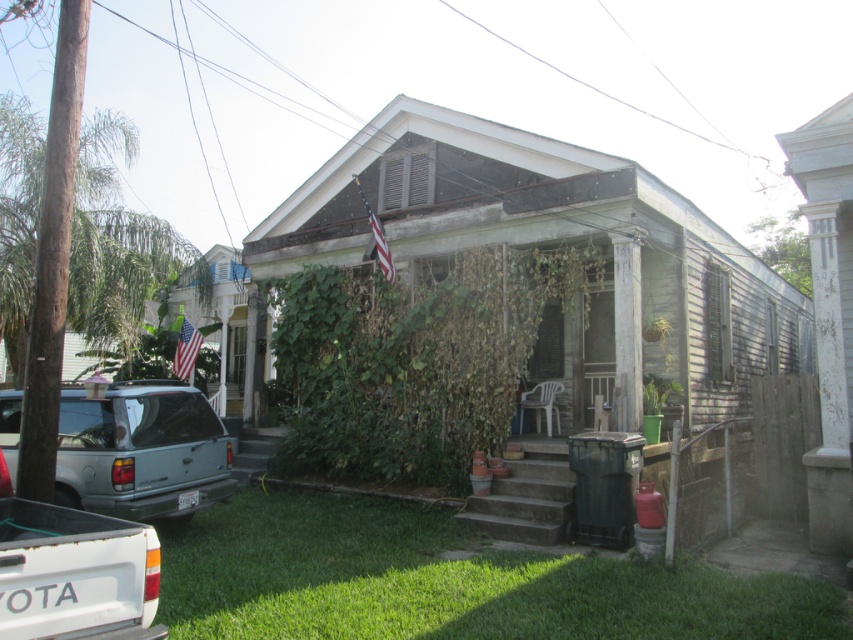
Question: Is metallic silver suv at lower left positioned before white matte truck at lower left?

Choices:
 (A) yes
 (B) no

Answer: (B)

Question: Which point is farther from the camera taking this photo?

Choices:
 (A) (106, 618)
 (B) (109, 496)

Answer: (B)

Question: From the image, what is the correct spatial relationship of metallic silver suv at lower left in relation to white matte truck at lower left?

Choices:
 (A) right
 (B) left

Answer: (B)

Question: Does metallic silver suv at lower left have a smaller size compared to white matte truck at lower left?

Choices:
 (A) no
 (B) yes

Answer: (A)

Question: Which point is closer to the camera?

Choices:
 (A) white matte truck at lower left
 (B) metallic silver suv at lower left

Answer: (A)